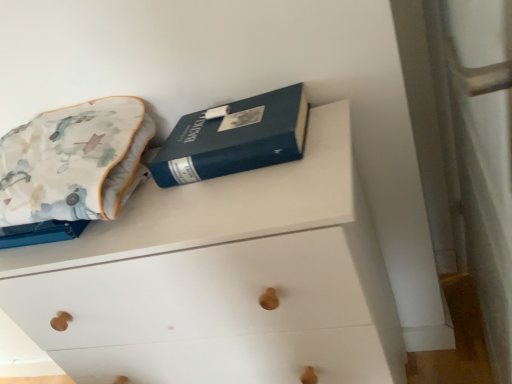
Question: Can you confirm if fluffy cotton throw pillow at upper left is positioned to the right of white matte chest of drawers at upper center?

Choices:
 (A) no
 (B) yes

Answer: (A)

Question: Is fluffy cotton throw pillow at upper left further to camera compared to white matte chest of drawers at upper center?

Choices:
 (A) no
 (B) yes

Answer: (B)

Question: Considering the relative sizes of fluffy cotton throw pillow at upper left and white matte chest of drawers at upper center in the image provided, is fluffy cotton throw pillow at upper left shorter than white matte chest of drawers at upper center?

Choices:
 (A) no
 (B) yes

Answer: (B)

Question: Is fluffy cotton throw pillow at upper left completely or partially outside of white matte chest of drawers at upper center?

Choices:
 (A) yes
 (B) no

Answer: (A)

Question: From a real-world perspective, is fluffy cotton throw pillow at upper left beneath white matte chest of drawers at upper center?

Choices:
 (A) no
 (B) yes

Answer: (A)

Question: Does fluffy cotton throw pillow at upper left lie in front of white matte chest of drawers at upper center?

Choices:
 (A) no
 (B) yes

Answer: (A)

Question: Is fluffy cotton throw pillow at upper left aimed at blue hardcover book at upper center?

Choices:
 (A) yes
 (B) no

Answer: (B)

Question: Does fluffy cotton throw pillow at upper left have a greater width compared to blue hardcover book at upper center?

Choices:
 (A) yes
 (B) no

Answer: (A)

Question: Would you consider fluffy cotton throw pillow at upper left to be distant from blue hardcover book at upper center?

Choices:
 (A) yes
 (B) no

Answer: (B)

Question: Is the surface of fluffy cotton throw pillow at upper left in direct contact with blue hardcover book at upper center?

Choices:
 (A) yes
 (B) no

Answer: (B)

Question: Can you confirm if fluffy cotton throw pillow at upper left is bigger than blue hardcover book at upper center?

Choices:
 (A) no
 (B) yes

Answer: (B)

Question: From the image's perspective, is fluffy cotton throw pillow at upper left beneath blue hardcover book at upper center?

Choices:
 (A) no
 (B) yes

Answer: (B)

Question: Can you confirm if white matte chest of drawers at upper center is wider than blue hardcover book at upper center?

Choices:
 (A) yes
 (B) no

Answer: (A)